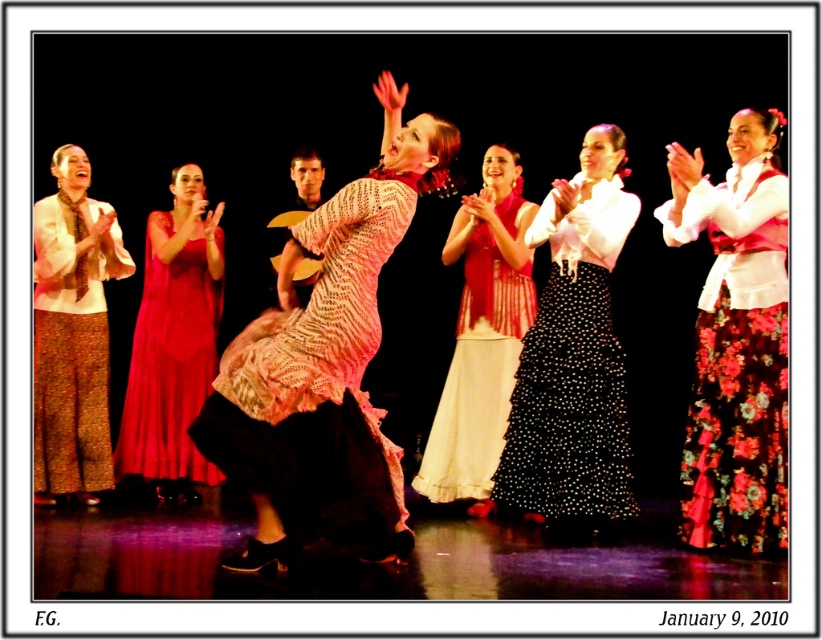
Is matte brown skirt at center thinner than red floral dress at center?

Yes.

Can you confirm if matte brown skirt at center is smaller than red floral dress at center?

Yes.

Locate an element on the screen. matte brown skirt at center is located at coordinates (72, 332).

Between printed silk dress at center and floral cotton skirt at center, which one appears on the right side from the viewer's perspective?

From the viewer's perspective, floral cotton skirt at center appears more on the right side.

Is printed silk dress at center bigger than floral cotton skirt at center?

Indeed, printed silk dress at center has a larger size compared to floral cotton skirt at center.

Locate an element on the screen. printed silk dress at center is located at coordinates (316, 384).

From the picture: Between floral cotton skirt at center and black dotted skirt at center, which one is positioned higher?

black dotted skirt at center

Between point (696, 518) and point (562, 477), which one is positioned behind?

Positioned behind is point (562, 477).

Identify the location of floral cotton skirt at center. This screenshot has width=822, height=640. (737, 339).